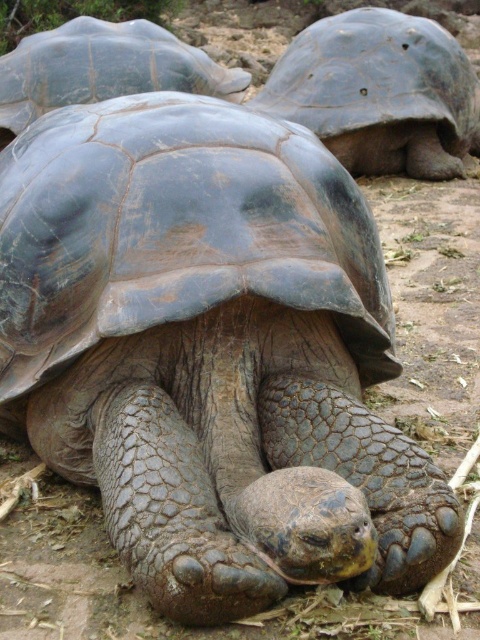
Is leathery gray tortoise at upper right closer to the viewer compared to smooth gray tortoise at center?

No.

Is point (371, 116) closer to camera compared to point (50, 74)?

No, (371, 116) is behind (50, 74).

Image resolution: width=480 pixels, height=640 pixels. What are the coordinates of `leathery gray tortoise at upper right` in the screenshot? It's located at (380, 92).